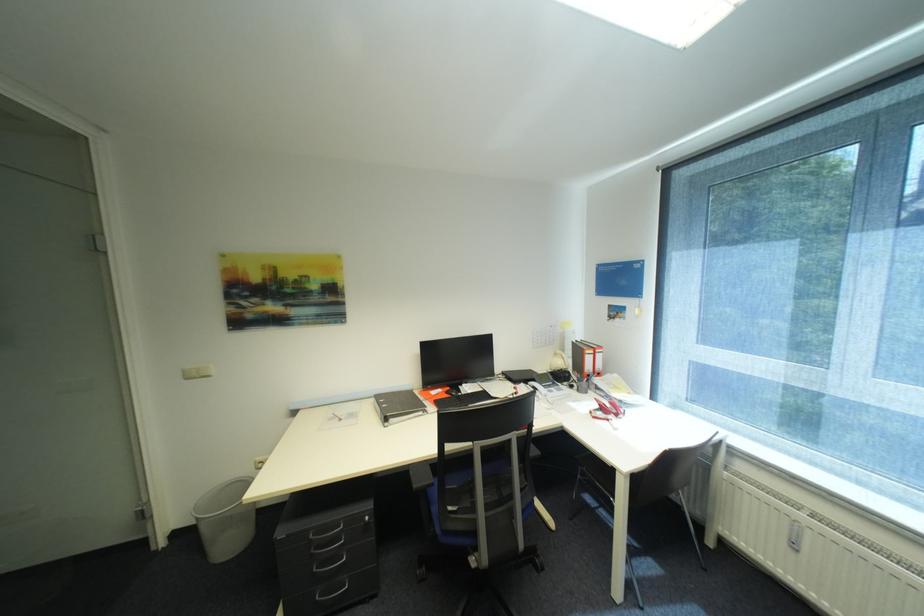
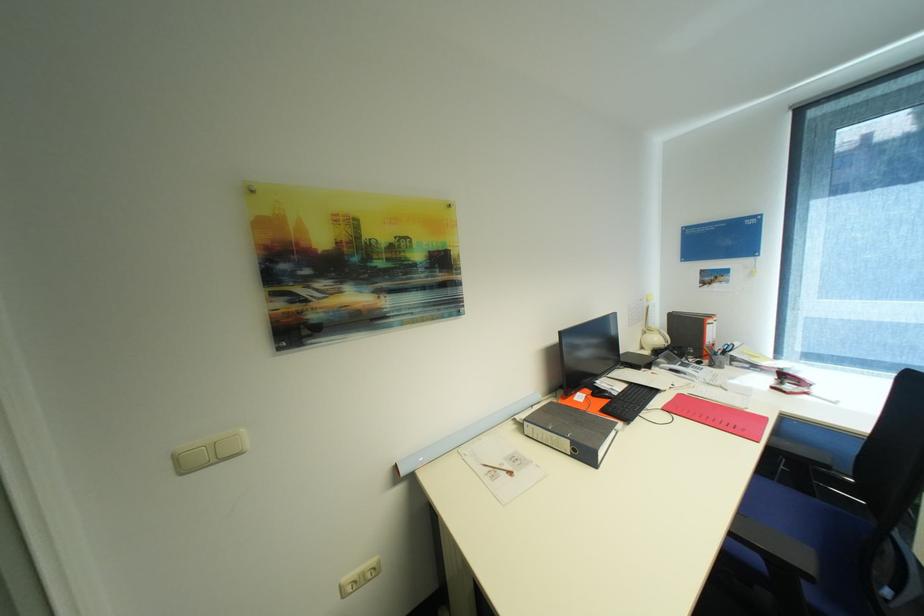
Find the pixel in the second image that matches the point at 615,419 in the first image.

(813, 394)